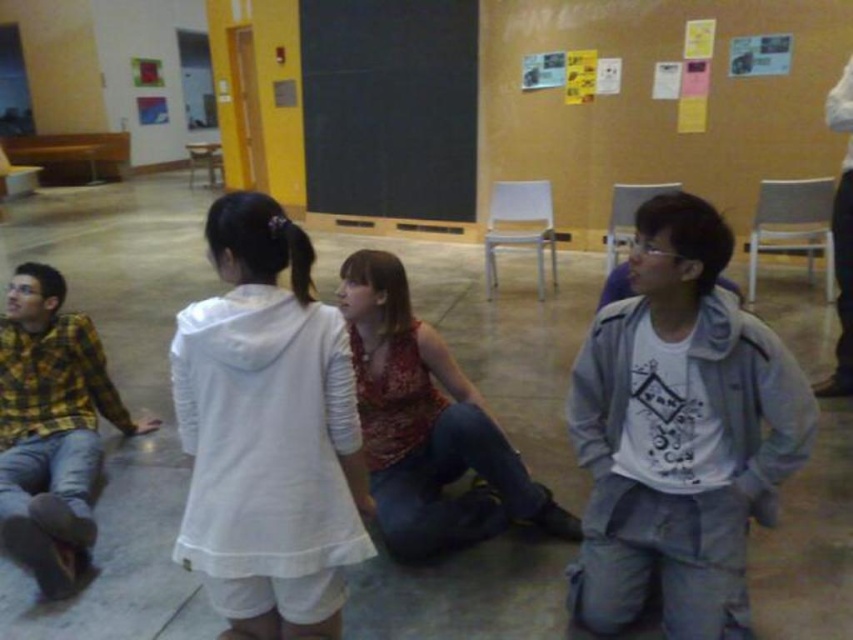
What do you see at coordinates (267, 433) in the screenshot?
I see `white cotton hoodie at center` at bounding box center [267, 433].

Does white cotton hoodie at center have a larger size compared to yellow plaid shirt at left?

Incorrect, white cotton hoodie at center is not larger than yellow plaid shirt at left.

Does point (215, 420) lie behind point (73, 451)?

No, (215, 420) is closer to viewer.

Identify the location of white cotton hoodie at center. (267, 433).

Who is more distant from viewer, (677,636) or (305,156)?

Point (305,156)

Does point (769, 506) come in front of point (422, 29)?

Yes, point (769, 506) is in front of point (422, 29).

Is point (705, 362) closer to camera compared to point (320, 6)?

That is True.

This screenshot has width=853, height=640. Find the location of `gray matte jacket at right`. gray matte jacket at right is located at coordinates (679, 433).

Can you confirm if white cotton hoodie at center is positioned below printed fabric tank top at center?

Yes.

Where is `white cotton hoodie at center`? white cotton hoodie at center is located at coordinates (267, 433).

The width and height of the screenshot is (853, 640). Identify the location of white cotton hoodie at center. (267, 433).